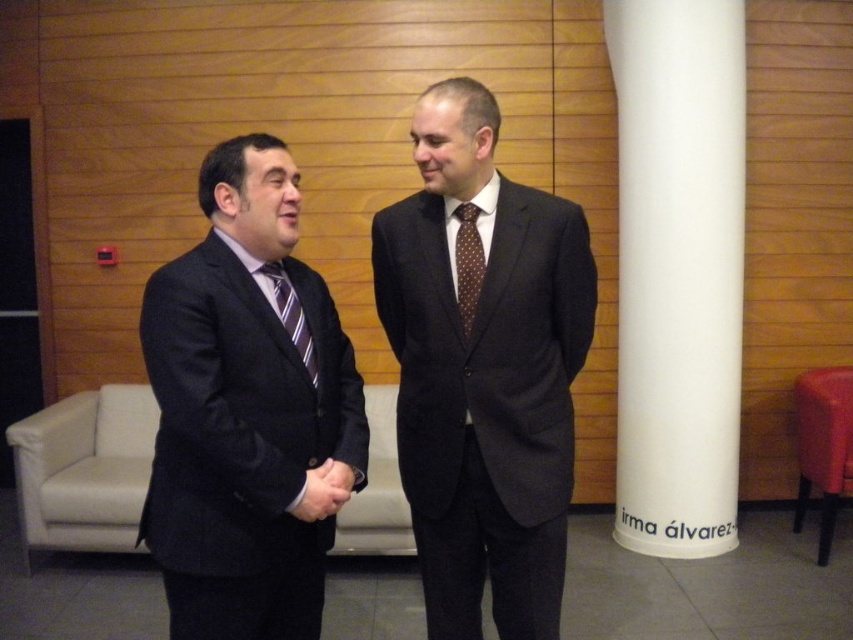
You are a photographer positioned at the entrance of the room. You need to take a photo that captures both the dark gray suit at center and the brown dotted tie at center clearly. Which object will appear larger in the photo?

The dark gray suit at center will appear larger in the photo because it is closer to the viewer than the brown dotted tie at center.

You are a photographer setting up for a group photo in the office. You need to position the white smooth pillar at right and the striped silk tie at center so that they are exactly 2 meters apart. Based on the current setup, do you need to move them closer or farther apart?

The white smooth pillar at right and striped silk tie at center are currently 2.07 meters apart. Since 2.07 meters is slightly more than 2 meters, you need to move them closer by 0.07 meters to achieve the desired distance.

You are an event planner arranging seating for a meeting. You need to seat the person in the dark gray suit at center and the person with the brown dotted tie at center. Since the table is narrow, you must determine which of the two requires more space. Which one needs more space?

The dark gray suit at center requires more space because its width surpasses that of the brown dotted tie at center.